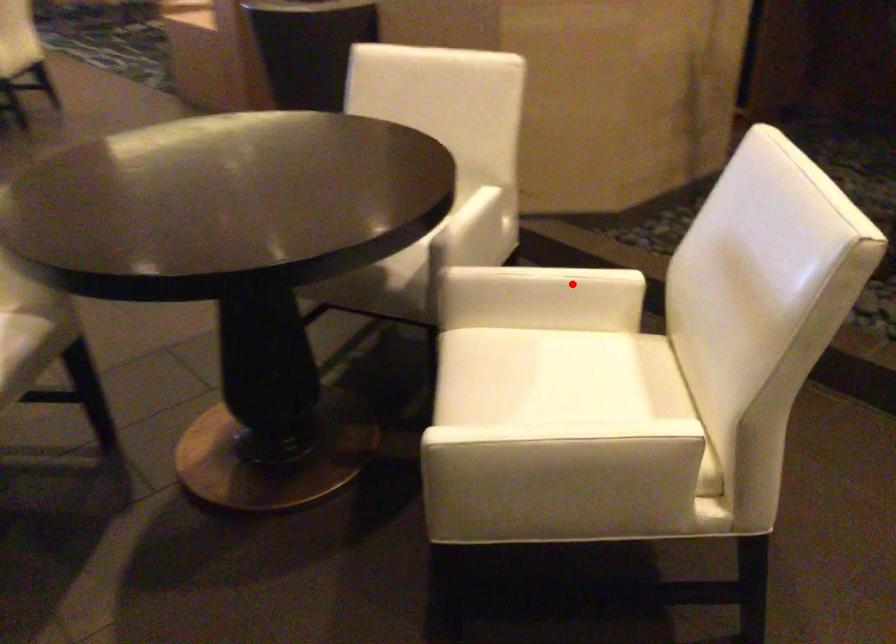
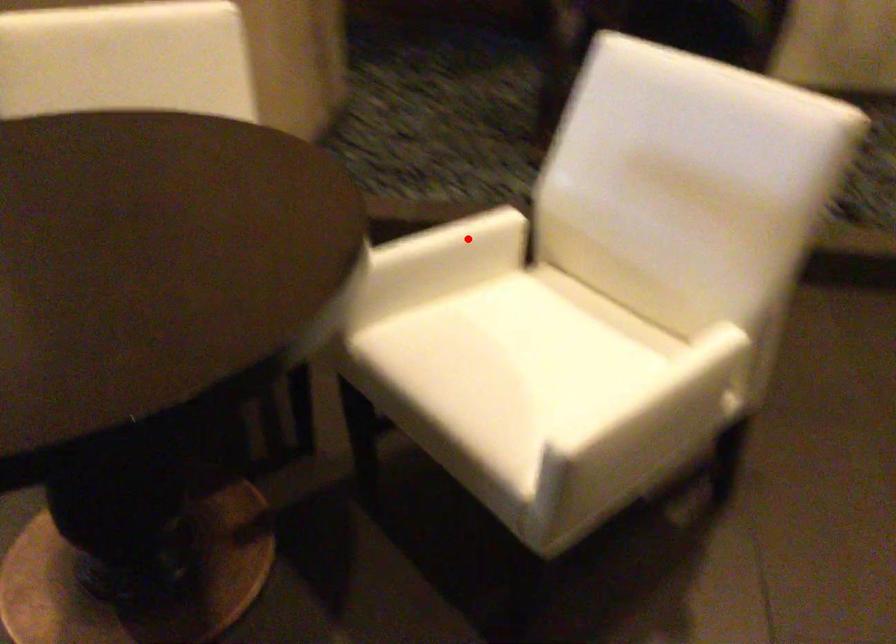
I am providing you with two images of the same scene from different viewpoints. A red point is marked on the first image and another point is marked on the second image. Are the points marked in image1 and image2 representing the same 3D position?

Yes